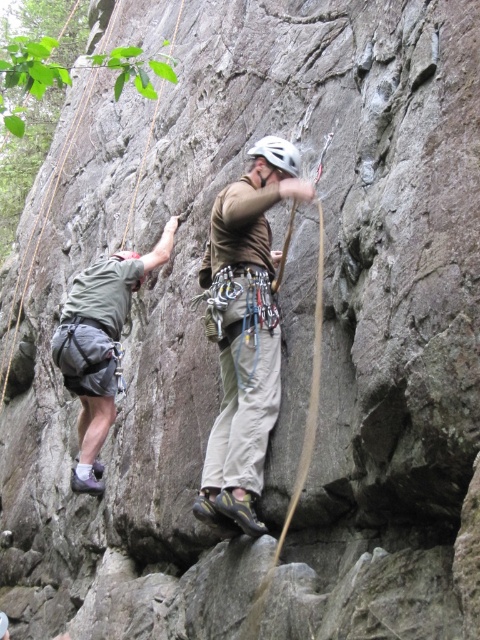
Question: Is khaki cotton pants at center smaller than gray fabric shorts at left?

Choices:
 (A) yes
 (B) no

Answer: (A)

Question: Considering the relative positions of gray fabric shorts at left and white matte helmet at center in the image provided, where is gray fabric shorts at left located with respect to white matte helmet at center?

Choices:
 (A) left
 (B) right

Answer: (A)

Question: Where is khaki cotton pants at center located in relation to gray fabric shorts at left in the image?

Choices:
 (A) right
 (B) left

Answer: (A)

Question: Estimate the real-world distances between objects in this image. Which object is farther from the white matte helmet at center?

Choices:
 (A) khaki cotton pants at center
 (B) gray fabric shorts at left

Answer: (B)

Question: Which point is farther to the camera?

Choices:
 (A) gray fabric shorts at left
 (B) white matte helmet at center

Answer: (A)

Question: Among these points, which one is nearest to the camera?

Choices:
 (A) (291, 147)
 (B) (92, 426)
 (C) (261, 186)

Answer: (C)